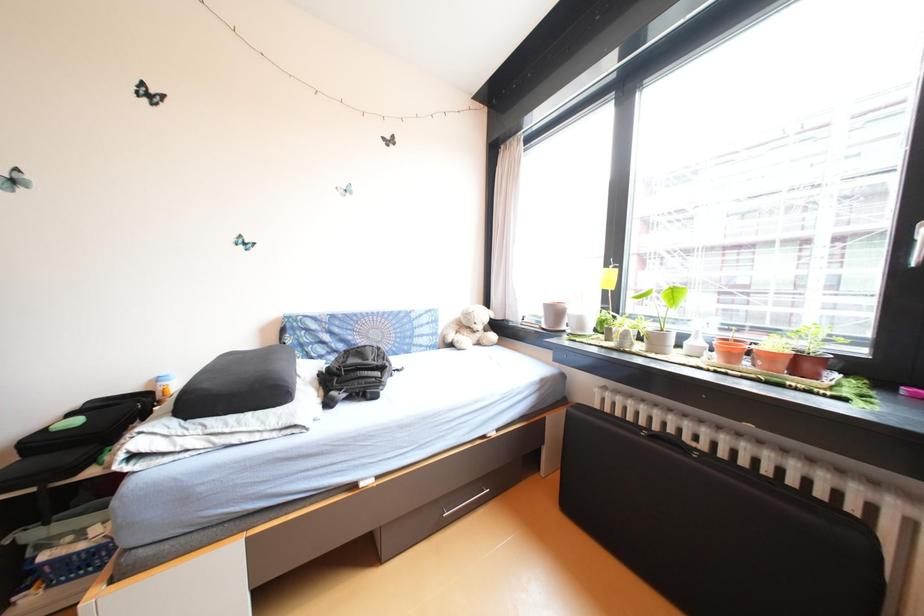
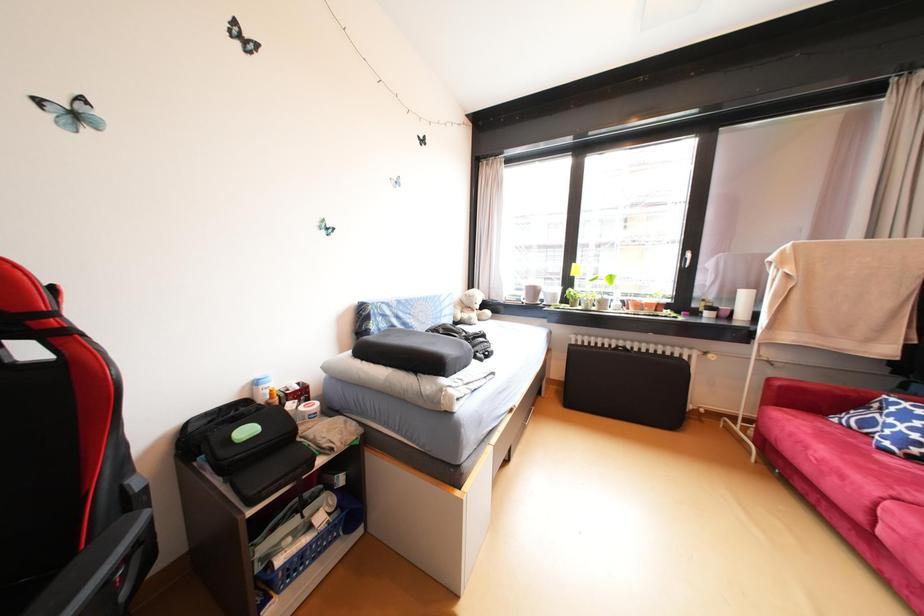
Question: In a continuous first-person perspective shot, in which direction is the camera moving?

Choices:
 (A) Left
 (B) Right
 (C) Forward
 (D) Backward

Answer: (A)